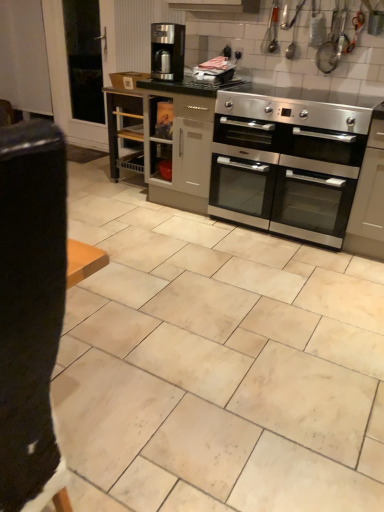
Find the location of `vacant space in front of stainless steel oven at center`. vacant space in front of stainless steel oven at center is located at coordinates (281, 270).